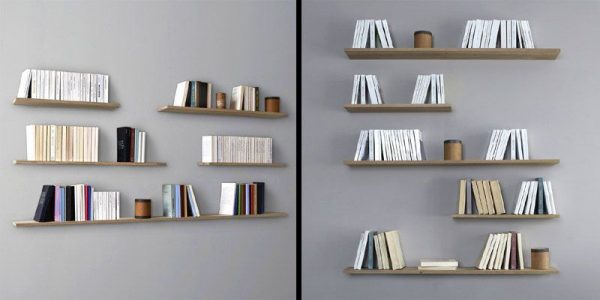
At what (x,y) coordinates should I click in order to perform the action: click on bookshelves. Please return your answer as a coordinate pair (x, y). This screenshot has width=600, height=300. Looking at the image, I should click on (68, 102), (232, 111), (102, 162), (280, 165), (28, 222), (443, 49), (394, 102), (476, 160), (512, 214), (462, 268).